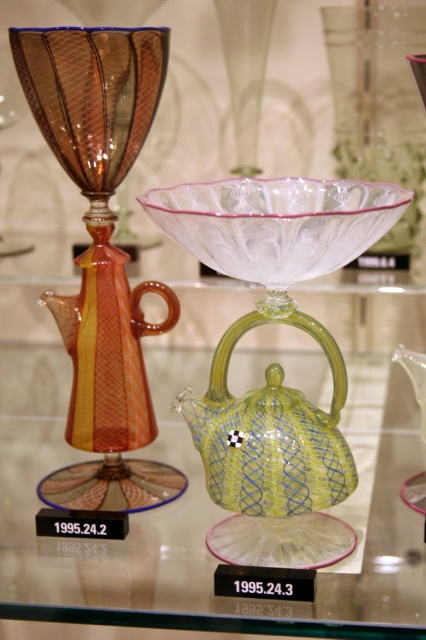
Question: Is green textured teapot at center thinner than amber glass teapot at left?

Choices:
 (A) yes
 (B) no

Answer: (B)

Question: Can you confirm if green textured teapot at center is thinner than amber glass teapot at left?

Choices:
 (A) no
 (B) yes

Answer: (A)

Question: Is green textured teapot at center to the left of amber glass teapot at left from the viewer's perspective?

Choices:
 (A) yes
 (B) no

Answer: (B)

Question: Which point appears farthest from the camera in this image?

Choices:
 (A) (412, 152)
 (B) (354, 440)

Answer: (A)

Question: Which point is closer to the camera taking this photo?

Choices:
 (A) (72, 115)
 (B) (98, 580)
 (C) (356, 83)
 (D) (365, 193)

Answer: (B)

Question: Which point is closer to the camera?

Choices:
 (A) green textured teapot at center
 (B) transparent glass bowl at center
 (C) green textured glass teapot at center

Answer: (B)